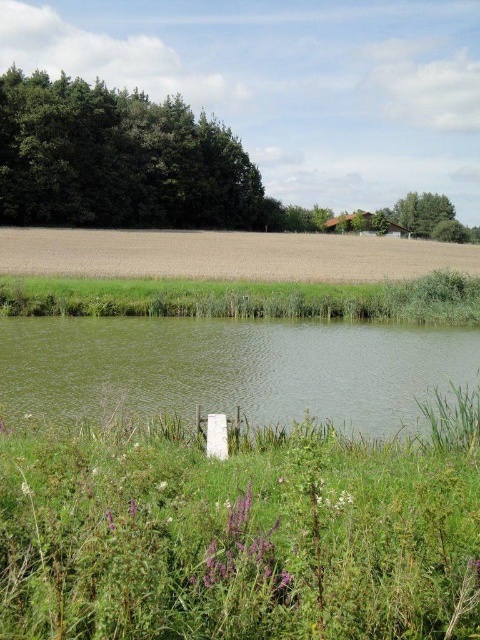
You are standing in the rural landscape scene and want to walk from the point closer to you to the farther point. Which path would you take between the two points, point (416, 451) and point (59, 234)?

You should walk from point (416, 451) to point (59, 234) because point (416, 451) is closer to the viewer and the other point is farther away.

You are a farmer planning to install a sprinkler system that can cover a maximum distance of 250 feet. You have two fields to irrigate, the green grassy patch at lower left and the brown matte field at center. Can the sprinkler reach both fields from the same location?

The distance between the green grassy patch at lower left and the brown matte field at center is 251.91 feet, which exceeds the sprinkler system maximum coverage of 250 feet. Therefore, the sprinkler cannot reach both fields from the same location.

You are a gardener planning to plant flowers in the green grassy patch at lower left and the green water at center. Since you want to plant more flowers in the area with more space, which location should you choose?

The green water at center has a greater width than the green grassy patch at lower left, so you should choose the green water at center to plant more flowers since it has more space.